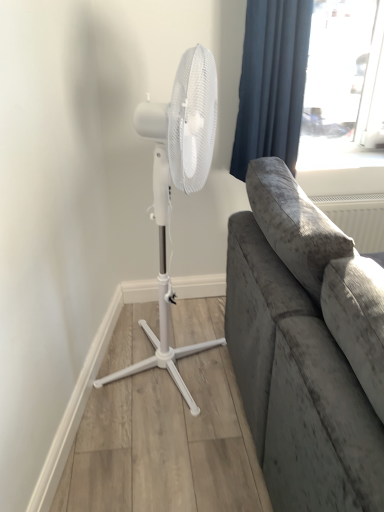
Locate an element on the screen. This screenshot has width=384, height=512. free point below white plastic mechanical fan at left (from a real-world perspective) is located at coordinates click(156, 366).